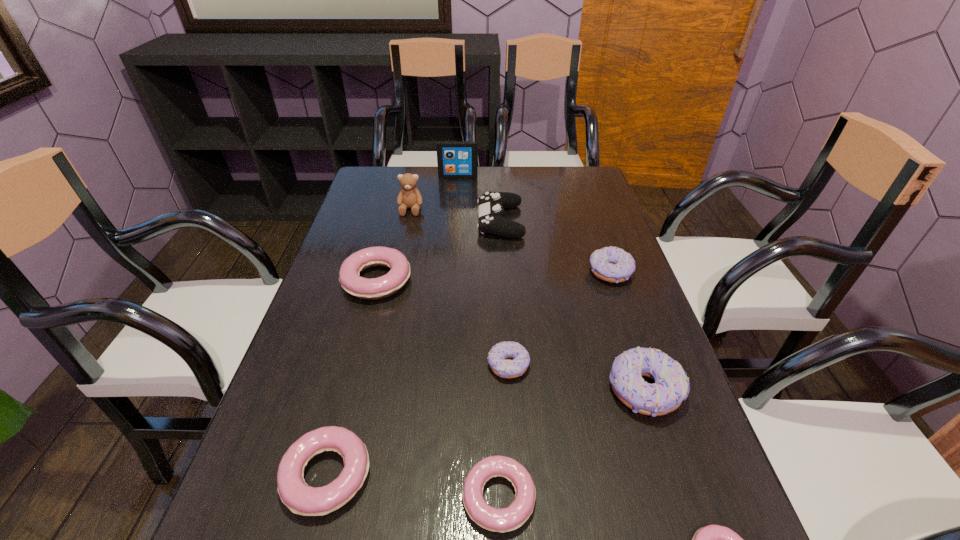
Identify the location of object located in the far edge section of the desktop. This screenshot has width=960, height=540. (456, 159).

Find the location of a particular element. This screenshot has width=960, height=540. teddy bear at the left edge is located at coordinates (409, 197).

You are a GUI agent. You are given a task and a screenshot of the screen. Output one action in this format:
    pyautogui.click(x=<x>, y=<y>)
    Task: Click on the free space at the far edge of the desktop
    The width and height of the screenshot is (960, 540).
    Given the screenshot: What is the action you would take?
    pyautogui.click(x=435, y=174)

Where is `vacant position at the left edge of the desktop`? vacant position at the left edge of the desktop is located at coordinates (325, 327).

You are a GUI agent. You are given a task and a screenshot of the screen. Output one action in this format:
    pyautogui.click(x=<x>, y=<y>)
    Task: Click on the vacant position at the right edge of the desktop
    The image size is (960, 540).
    Given the screenshot: What is the action you would take?
    pyautogui.click(x=572, y=218)

You are a GUI agent. You are given a task and a screenshot of the screen. Output one action in this format:
    pyautogui.click(x=<x>, y=<y>)
    Task: Click on the vacant space at the far left corner of the desktop
    Image resolution: width=960 pixels, height=540 pixels.
    Given the screenshot: What is the action you would take?
    pyautogui.click(x=384, y=199)

The height and width of the screenshot is (540, 960). Identify the location of free location at the far right corner. (574, 184).

Image resolution: width=960 pixels, height=540 pixels. I want to click on empty space between the third pink doughnut from left to right and the brown teddy bear, so click(455, 353).

Find the location of a particular element. This screenshot has width=960, height=540. free space between the brown teddy bear and the third smallest pink doughnut is located at coordinates (369, 342).

This screenshot has width=960, height=540. I want to click on vacant space in between the tallest doughnut and the control, so click(572, 306).